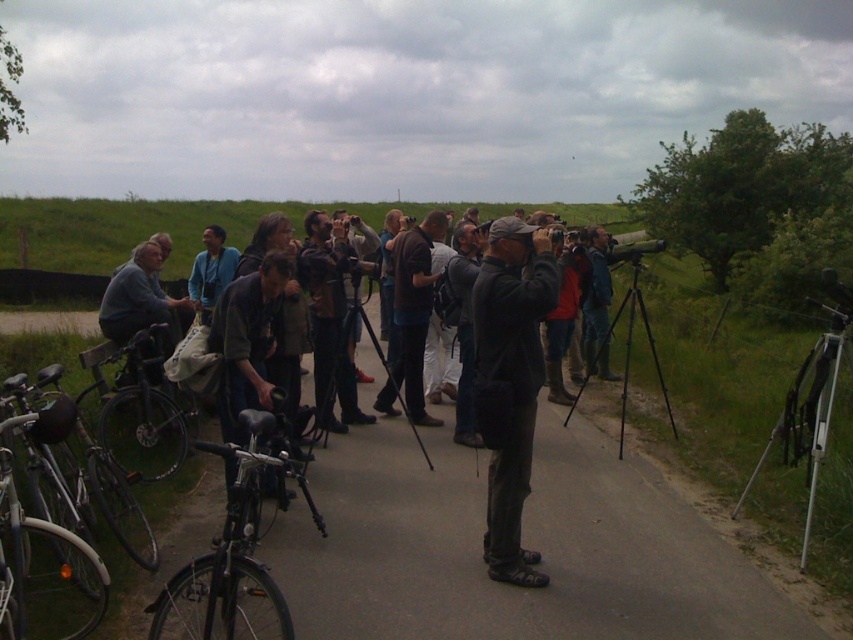
You are a photographer who wants to set up your equipment on the dark gray asphalt road at center. However, you also need to place your black matte tripod at center. Given their sizes, can both items fit side by side on the path without overlapping?

The dark gray asphalt road at center occupies less space than the black matte tripod at center. Therefore, the tripod requires more space than the road can provide, making it impossible to place both side by side without overlapping.

You are a photographer who wants to set up your equipment on the dark gray asphalt road at center without blocking the black matte tripod at center. Is there enough space to place your equipment on the road?

The dark gray asphalt road at center is located below the black matte tripod at center, so placing equipment on the road would not interfere with the tripod since they are at different vertical positions.

You are planning to ride a bicycle from the path to a nearby parking lot. You see the silver metallic bicycle at left and the blue fabric jacket at center. Which bicycle should you choose if you prefer a smaller one?

The silver metallic bicycle at left has a smaller size compared to the blue fabric jacket at center, so you should choose the silver metallic bicycle at left.